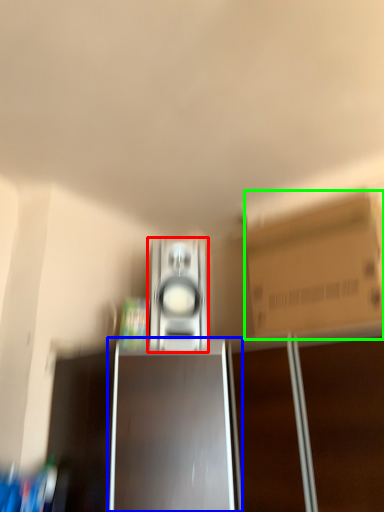
Question: Which object is positioned closest to home appliance (highlighted by a red box)? Select from cabinetry (highlighted by a blue box) and cardboard box (highlighted by a green box).

Choices:
 (A) cabinetry
 (B) cardboard box

Answer: (A)